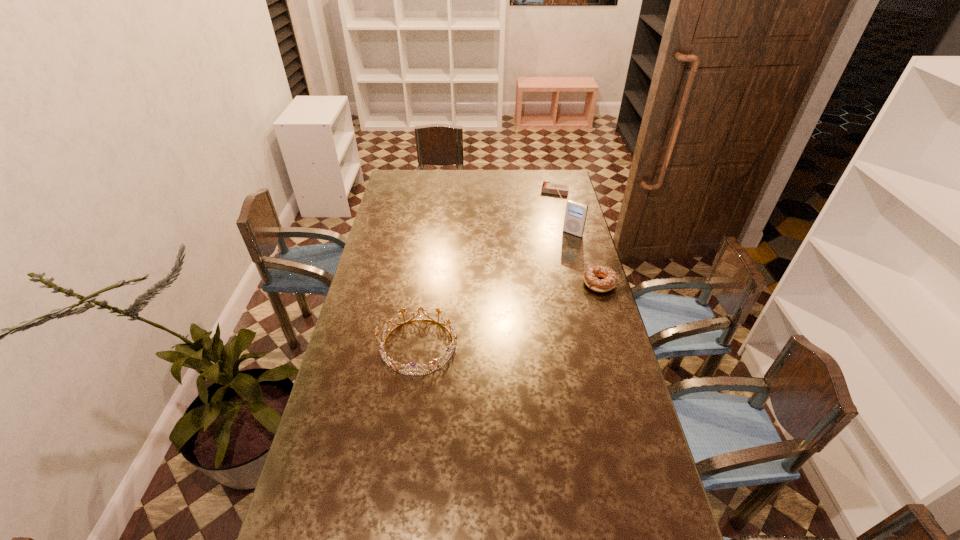
The height and width of the screenshot is (540, 960). In order to click on free region located on the front of the third tallest object in this screenshot , I will do `click(606, 305)`.

Identify the location of free space located 0.320m on the front-facing side of the iPod. The height and width of the screenshot is (540, 960). (535, 278).

At what (x,y) coordinates should I click in order to perform the action: click on free space located 0.300m on the front-facing side of the iPod. Please return your answer as a coordinate pair (x, y). The width and height of the screenshot is (960, 540). Looking at the image, I should click on (537, 275).

At what (x,y) coordinates should I click in order to perform the action: click on free region located on the front-facing side of the iPod. Please return your answer as a coordinate pair (x, y). The image size is (960, 540). Looking at the image, I should click on (532, 281).

You are a GUI agent. You are given a task and a screenshot of the screen. Output one action in this format:
    pyautogui.click(x=<x>, y=<y>)
    Task: Click on the free location located 0.230m on the striking surface of the farthest object
    
    Given the screenshot: What is the action you would take?
    pyautogui.click(x=547, y=226)

Identify the location of blank area located on the striking surface of the farthest object. Image resolution: width=960 pixels, height=540 pixels. (547, 228).

Where is `vacant space positioned 0.250m on the striking surface of the farthest object`? This screenshot has width=960, height=540. vacant space positioned 0.250m on the striking surface of the farthest object is located at coordinates (547, 228).

Where is `object at the far edge`? The width and height of the screenshot is (960, 540). object at the far edge is located at coordinates (547, 187).

This screenshot has width=960, height=540. Identify the location of object located in the left edge section of the desktop. (392, 364).

Where is `doughnut situated at the right edge`? The width and height of the screenshot is (960, 540). doughnut situated at the right edge is located at coordinates (609, 282).